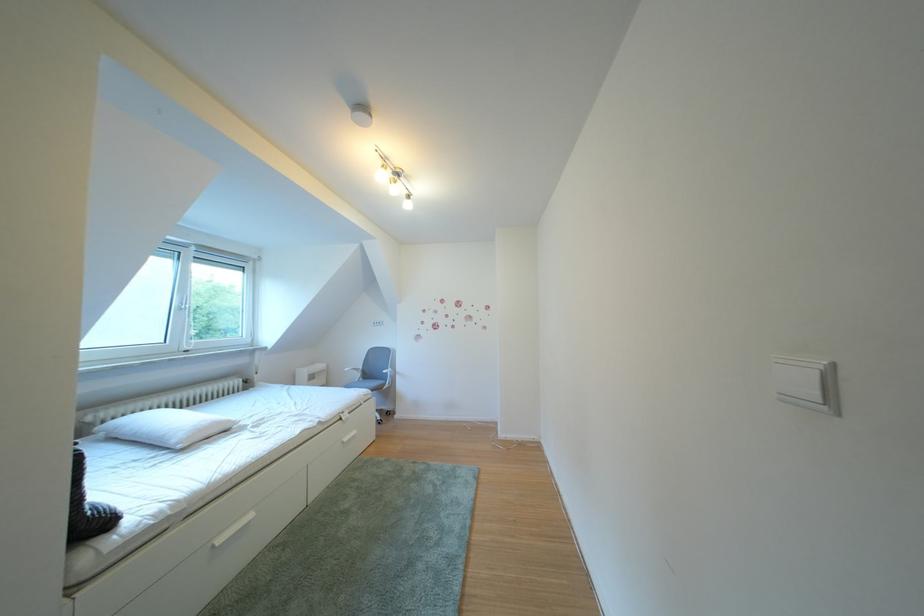
Find where to press the white light switch. Please return your answer as a coordinate pair (x, y).

(798, 382)